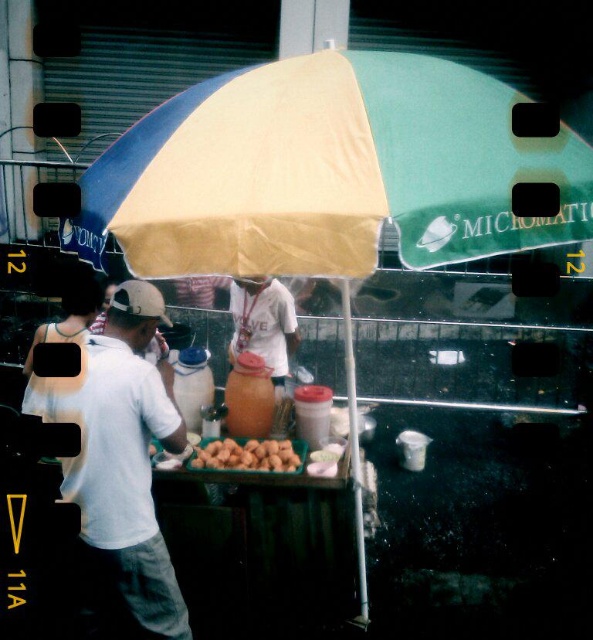
You are a customer at the street food vendor stall. You want to grab both the white matte shirt at center and the white jersey at center from the table. Can you reach both items without moving your position?

The white matte shirt at center is 1.48 meters away from the white jersey at center. Since the distance between them is 1.48 meters, you would need to move your position to reach both items unless you have an arm span that can cover that distance.

You are a customer at the street food vendor stall. You want to place both the white matte shirt at center and the brown matte nuts at center on the table. Which item should you place first to ensure there is enough space for both?

You should place the brown matte nuts at center first since the white matte shirt at center is wider and requires more space. This way, there will be enough room left for the larger item.

You are a customer at the street food vendor stall. You notice two white items at the center of the table. Which one is closer to you, the white matte shirt at center or the white jersey at center?

The white matte shirt at center is closer to you because it is in front of the white jersey at center.